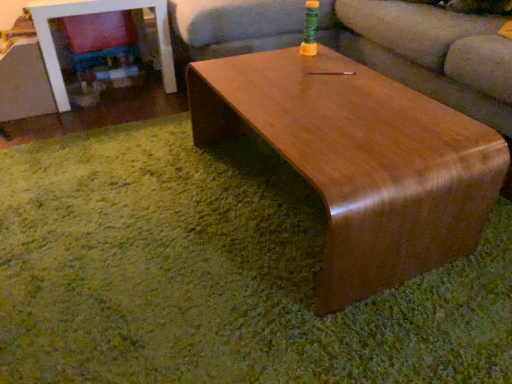
Question: From the image's perspective, is glossy wood table at center above matte brown couch at center?

Choices:
 (A) yes
 (B) no

Answer: (B)

Question: Does glossy wood table at center have a lesser width compared to matte brown couch at center?

Choices:
 (A) no
 (B) yes

Answer: (B)

Question: Can we say glossy wood table at center lies outside matte brown couch at center?

Choices:
 (A) no
 (B) yes

Answer: (B)

Question: Considering the relative sizes of glossy wood table at center and matte brown couch at center in the image provided, is glossy wood table at center smaller than matte brown couch at center?

Choices:
 (A) no
 (B) yes

Answer: (B)

Question: Is the position of glossy wood table at center less distant than that of matte brown couch at center?

Choices:
 (A) yes
 (B) no

Answer: (B)

Question: Is glossy wood table at center beside matte brown couch at center?

Choices:
 (A) no
 (B) yes

Answer: (A)

Question: Is matte brown couch at center facing towards glossy wood table at center?

Choices:
 (A) no
 (B) yes

Answer: (B)

Question: Can you confirm if matte brown couch at center is positioned to the right of glossy wood table at center?

Choices:
 (A) no
 (B) yes

Answer: (B)

Question: Is there a large distance between matte brown couch at center and glossy wood table at center?

Choices:
 (A) no
 (B) yes

Answer: (A)

Question: Can glossy wood table at center be found inside matte brown couch at center?

Choices:
 (A) yes
 (B) no

Answer: (B)

Question: Is matte brown couch at center shorter than glossy wood table at center?

Choices:
 (A) no
 (B) yes

Answer: (B)

Question: Is matte brown couch at center closer to camera compared to glossy wood table at center?

Choices:
 (A) no
 (B) yes

Answer: (B)

Question: Can you confirm if matte brown couch at center is bigger than shiny brown wood coffee table at center?

Choices:
 (A) no
 (B) yes

Answer: (B)